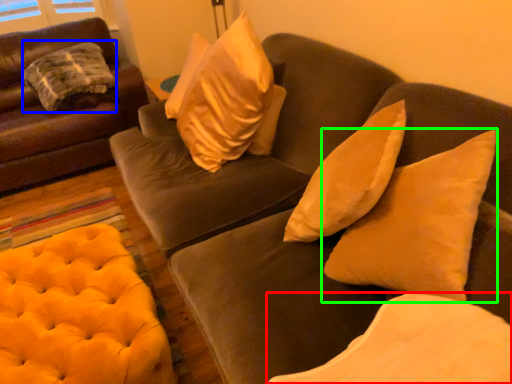
Question: Which is nearer to the pillow (highlighted by a red box)? pillow (highlighted by a blue box) or pillow (highlighted by a green box).

Choices:
 (A) pillow
 (B) pillow

Answer: (B)